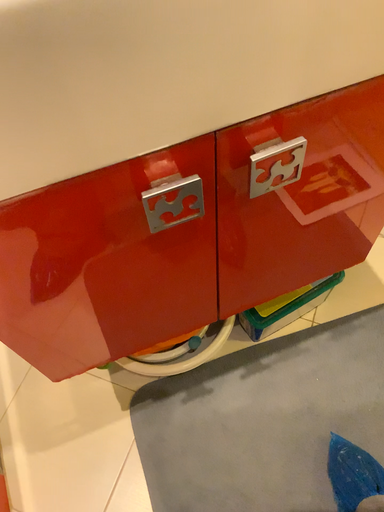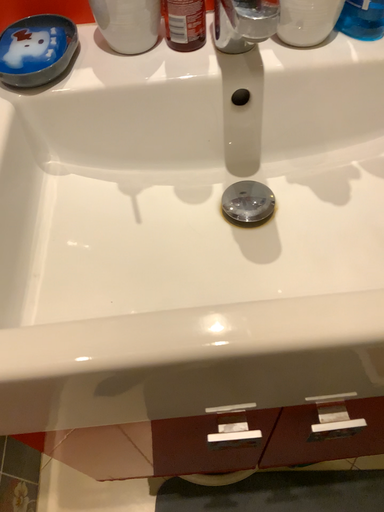
Question: Which way did the camera rotate in the video?

Choices:
 (A) rotated right
 (B) rotated left

Answer: (B)